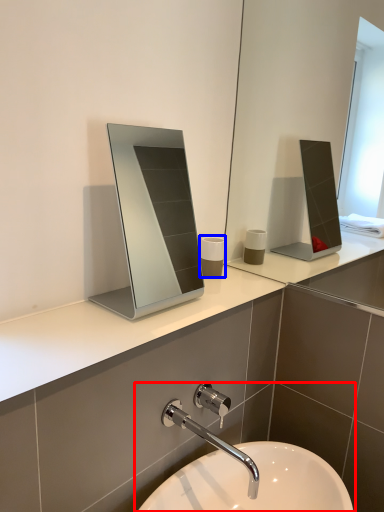
Question: Which object is further to the camera taking this photo, sink (highlighted by a red box) or toiletry (highlighted by a blue box)?

Choices:
 (A) sink
 (B) toiletry

Answer: (B)